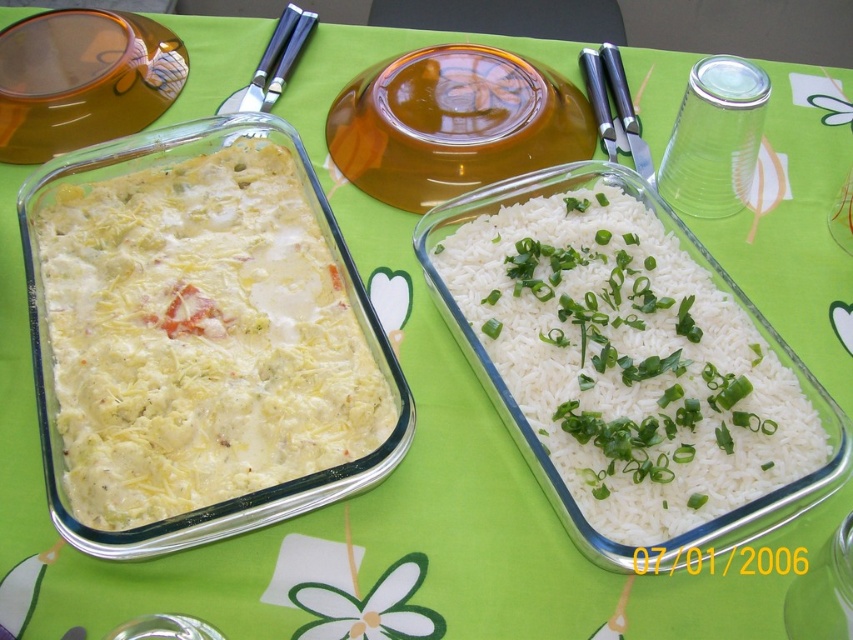
Based on the photo, you are a food critic who wants to take a photo of the white creamy cheese casserole at left and the white matte rice at center. Which dish should you focus on first to capture their heights accurately in the photo?

The white creamy cheese casserole at left is much taller than the white matte rice at center, so you should focus on the white creamy cheese casserole at left first to capture its height accurately before adjusting for the shorter white matte rice at center.

You are a guest at a dinner party and see the table setting described. There is a point marked at coordinates (200, 337). Which dish does this point indicate?

The point at coordinates (200, 337) marks the white creamy cheese casserole at left.

You are a food photographer setting up a shot for a magazine. You need to ensure that the white creamy cheese casserole at left and the white matte rice at center are framed properly. Which dish should you adjust to the right to create more balance in the composition?

The white creamy cheese casserole at left is wider than the white matte rice at center, so adjusting the white creamy cheese casserole at left to the right would help balance the composition by compensating for its greater width.